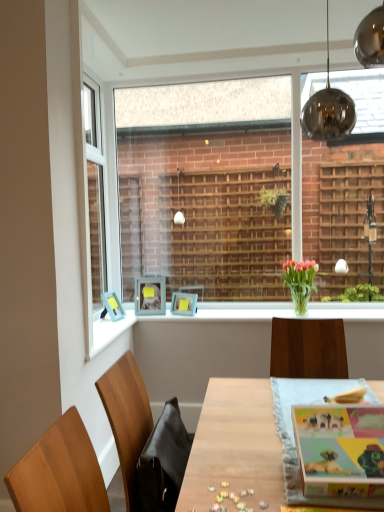
Question: Considering the relative sizes of wooden table at center and matte blue picture frame at center, arranged as the 1th picture frame when viewed from the left, in the image provided, is wooden table at center bigger than matte blue picture frame at center, arranged as the 1th picture frame when viewed from the left,?

Choices:
 (A) yes
 (B) no

Answer: (A)

Question: Can you confirm if wooden table at center is positioned to the right of matte blue picture frame at center, arranged as the 1th picture frame when viewed from the left?

Choices:
 (A) yes
 (B) no

Answer: (A)

Question: Is wooden table at center facing away from matte blue picture frame at center, acting as the 3th picture frame starting from the right?

Choices:
 (A) yes
 (B) no

Answer: (B)

Question: Is wooden table at center located outside matte blue picture frame at center, acting as the 3th picture frame starting from the right?

Choices:
 (A) no
 (B) yes

Answer: (B)

Question: Is wooden table at center oriented towards matte blue picture frame at center, acting as the 3th picture frame starting from the right?

Choices:
 (A) yes
 (B) no

Answer: (B)

Question: Considering the positions of black leather swivel chair at lower left and light blue plastic picture frame at upper left, the second picture frame when ordered from right to left, in the image, is black leather swivel chair at lower left taller or shorter than light blue plastic picture frame at upper left, the second picture frame when ordered from right to left,?

Choices:
 (A) short
 (B) tall

Answer: (A)

Question: Do you think black leather swivel chair at lower left is within light blue plastic picture frame at upper left, the second picture frame when ordered from right to left, or outside of it?

Choices:
 (A) outside
 (B) inside

Answer: (A)

Question: Considering the relative positions of black leather swivel chair at lower left and light blue plastic picture frame at upper left, the 2th picture frame viewed from the left, in the image provided, is black leather swivel chair at lower left to the left or to the right of light blue plastic picture frame at upper left, the 2th picture frame viewed from the left,?

Choices:
 (A) left
 (B) right

Answer: (B)

Question: Considering the positions of point (160, 506) and point (155, 309), is point (160, 506) closer or farther from the camera than point (155, 309)?

Choices:
 (A) closer
 (B) farther

Answer: (A)

Question: Based on their sizes in the image, would you say matte blue picture frame at center, arranged as the 1th picture frame when viewed from the left, is bigger or smaller than clear glass window at center?

Choices:
 (A) big
 (B) small

Answer: (B)

Question: Considering the positions of matte blue picture frame at center, acting as the 3th picture frame starting from the right, and clear glass window at center in the image, is matte blue picture frame at center, acting as the 3th picture frame starting from the right, wider or thinner than clear glass window at center?

Choices:
 (A) wide
 (B) thin

Answer: (A)

Question: Is matte blue picture frame at center, arranged as the 1th picture frame when viewed from the left, taller or shorter than clear glass window at center?

Choices:
 (A) short
 (B) tall

Answer: (A)

Question: Is point coord(104,303) positioned closer to the camera than point coord(114,287)?

Choices:
 (A) closer
 (B) farther

Answer: (A)

Question: Is translucent glass vase at center to the left or to the right of wooden table at center in the image?

Choices:
 (A) right
 (B) left

Answer: (A)

Question: Is point (296, 267) closer or farther from the camera than point (213, 480)?

Choices:
 (A) farther
 (B) closer

Answer: (A)